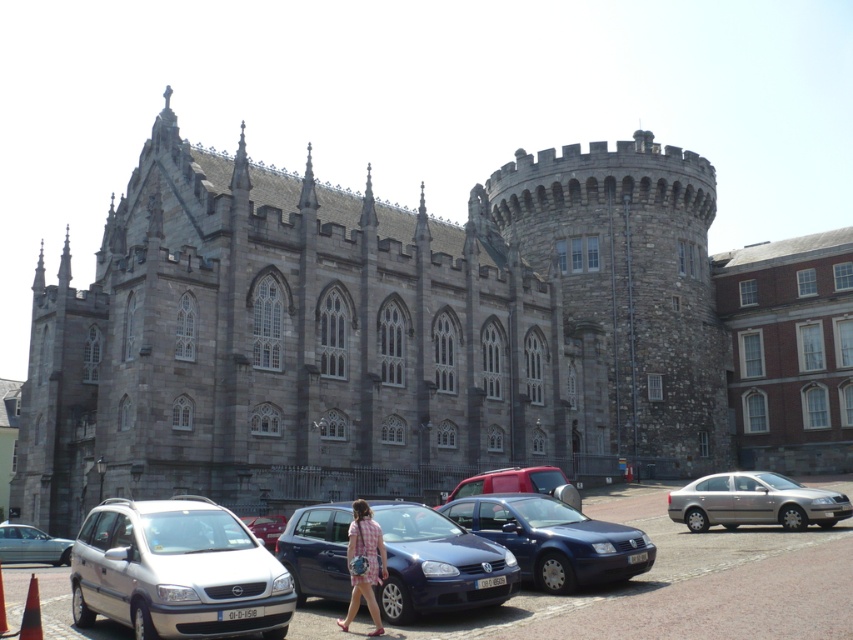
You are a photographer planning to capture the historic stone building with its Gothic architecture. You have a silver metallic sedan at right and a metallic silver van at center in your shot. Which vehicle should you position closer to the building to ensure the building remains the main focus without being obscured?

The silver metallic sedan at right is much taller than the metallic silver van at center, so positioning the metallic silver van at center closer to the building would prevent it from blocking the view, as it is shorter and less likely to obscure the historic structure.

You are a photographer planning to capture the gray stone castle at center and the white matte van at lower left in a single shot. Considering their sizes, which object should you position closer to the camera to ensure both are visible in the frame without cropping?

Since the gray stone castle at center is wider than the white matte van at lower left, you should position the white matte van at lower left closer to the camera to balance their sizes in the frame.